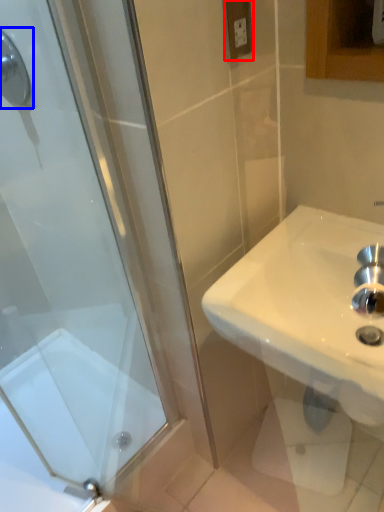
Question: Which point is closer to the camera, electric outlet (highlighted by a red box) or shower (highlighted by a blue box)?

Choices:
 (A) electric outlet
 (B) shower

Answer: (A)